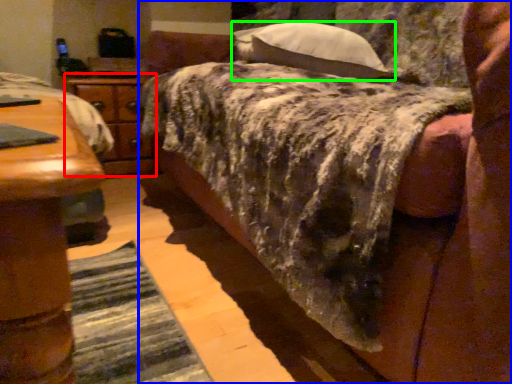
Question: Which object is the farthest from nightstand (highlighted by a red box)? Choose among these: bed (highlighted by a blue box) or pillow (highlighted by a green box).

Choices:
 (A) bed
 (B) pillow

Answer: (A)